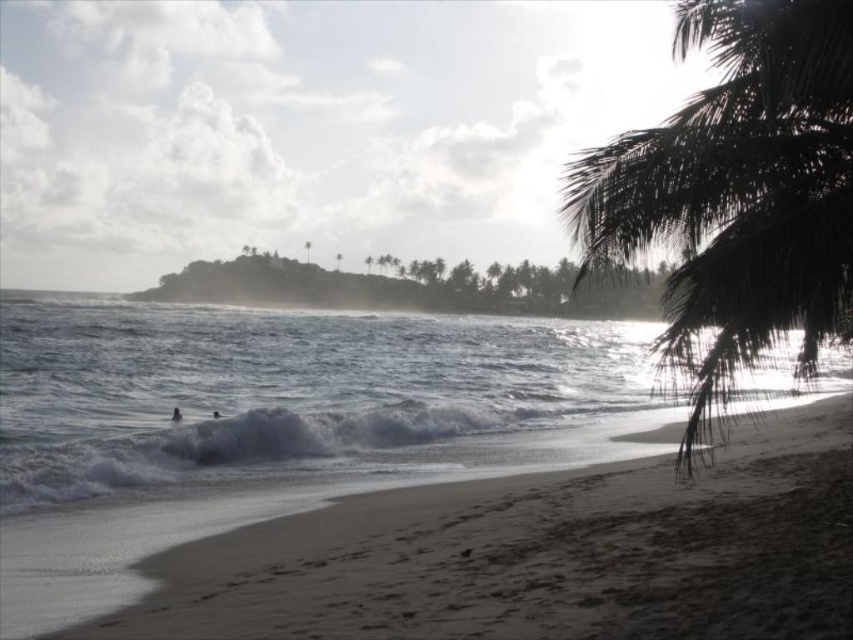
You are standing on the beach and want to take a photo of the white frothy water at lower left and the dark green leafy palm tree at right. Which object should you zoom in more on to capture its details clearly?

You should zoom in more on the white frothy water at lower left because it has a lesser height compared to the dark green leafy palm tree at right, making it smaller in the frame and requiring closer focus for detail.

You are standing on the sandy beach with footprints and want to walk to the point marked at coordinates (294, 396). Will you be stepping on the white frothy water at lower left or the palm fronds in the upper right?

The point at (294, 396) is on the white frothy water at lower left, so you will be stepping on the white frothy water at lower left.